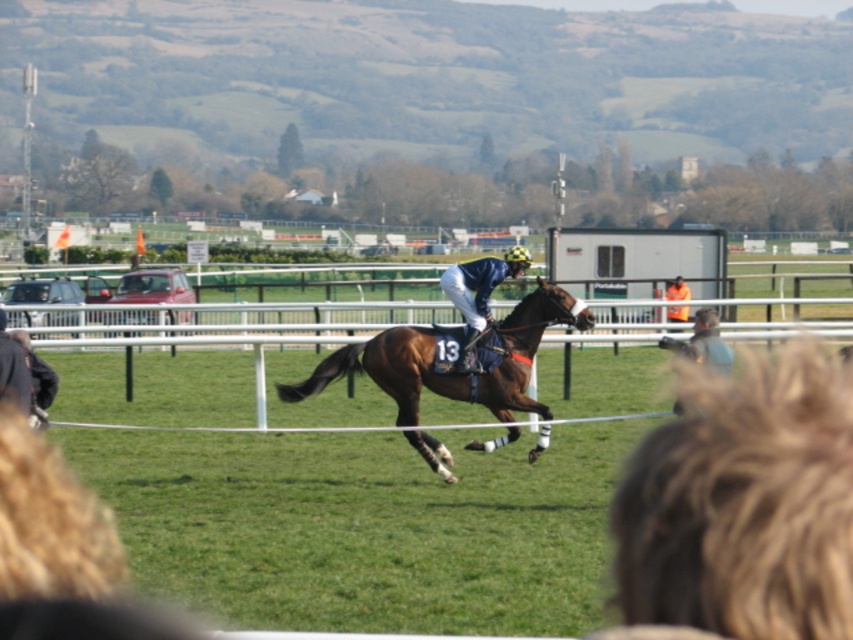
Looking at this image, you are a photographer at the horse racing event. You need to capture a clear photo of both the blue denim jacket at center and the blue fabric jockey at center. Which object should you focus on first to ensure proper depth of field?

The blue denim jacket at center is thinner than the blue fabric jockey at center, so you should focus on the blue fabric jockey at center first to ensure proper depth of field.

You are a photographer positioned at the edge of the racetrack. You want to take a photo of the shiny brown horse at center and the blue fabric jockey at center. Based on their sizes, which one should appear larger in your photo?

The shiny brown horse at center is wider than the blue fabric jockey at center, so the shiny brown horse at center should appear larger in the photo.

You are a photographer standing at the edge of the racetrack. You need to capture a photo of the shiny brown horse at center and the blue fabric jockey at center. Since you want to emphasize the horse, which object should you focus on first, considering their sizes?

The shiny brown horse at center is taller than the blue fabric jockey at center, so you should focus on the shiny brown horse at center first to emphasize its size.